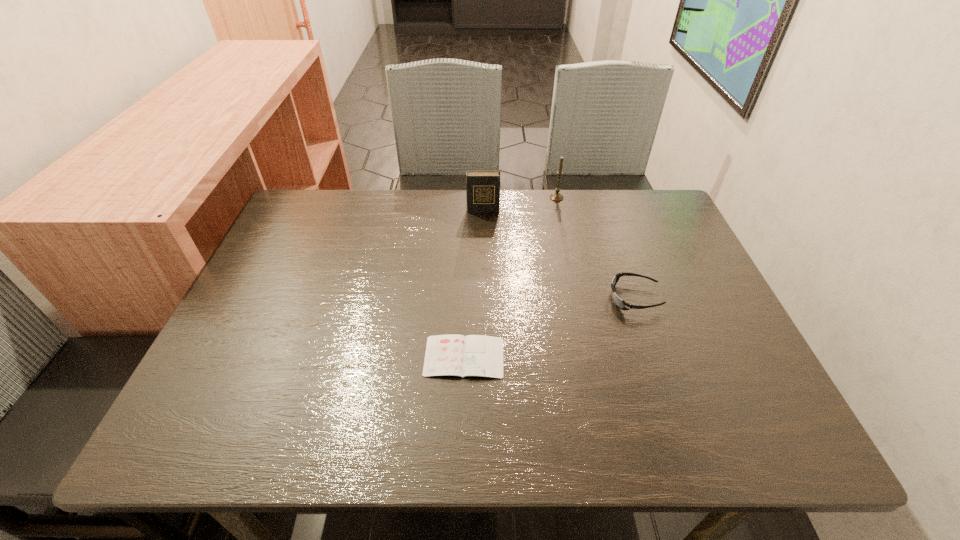
Where is `vacant space situated 0.060m on the lenses of the sunglasses`? vacant space situated 0.060m on the lenses of the sunglasses is located at coordinates (584, 298).

In order to click on vacant space located on the lenses of the sunglasses in this screenshot , I will do `click(452, 298)`.

At what (x,y) coordinates should I click in order to perform the action: click on free point located 0.370m on the lenses of the sunglasses. Please return your answer as a coordinate pair (x, y). Looking at the image, I should click on (452, 298).

Where is `vacant space located 0.240m on the back of the shorter diary`? The width and height of the screenshot is (960, 540). vacant space located 0.240m on the back of the shorter diary is located at coordinates (468, 263).

At what (x,y) coordinates should I click in order to perform the action: click on candle that is at the far edge. Please return your answer as a coordinate pair (x, y). The image size is (960, 540). Looking at the image, I should click on (557, 196).

At what (x,y) coordinates should I click in order to perform the action: click on diary that is at the far edge. Please return your answer as a coordinate pair (x, y). Looking at the image, I should click on (482, 187).

This screenshot has width=960, height=540. Identify the location of object positioned at the right edge. (621, 304).

Locate an element on the screen. Image resolution: width=960 pixels, height=540 pixels. free point at the far edge is located at coordinates (529, 222).

In the image, there is a desktop. At what (x,y) coordinates should I click in order to perform the action: click on vacant region at the near edge. Please return your answer as a coordinate pair (x, y). Image resolution: width=960 pixels, height=540 pixels. Looking at the image, I should click on (317, 423).

The image size is (960, 540). In the image, there is a desktop. Identify the location of vacant space at the left edge. (212, 372).